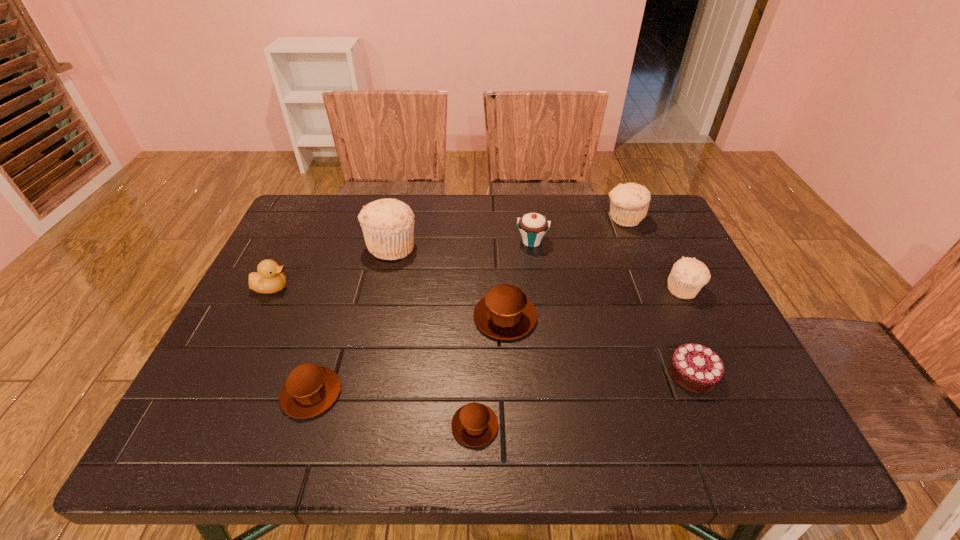
Locate an element on the screen. vacant region between the chocolate cake and the second biggest beige muffin is located at coordinates (659, 296).

In order to click on empty space that is in between the nearest beige muffin and the smallest brown muffin in this screenshot , I will do `click(580, 357)`.

Locate an element on the screen. object that is the sixth nearest to the leftmost object is located at coordinates (629, 203).

This screenshot has width=960, height=540. I want to click on object that stands as the fourth closest to the biggest brown muffin, so click(x=696, y=368).

Locate an element on the screen. This screenshot has height=540, width=960. muffin that is the sixth closest one to the leftmost object is located at coordinates (688, 275).

Choose which muffin is the fifth nearest neighbor to the nearest beige muffin. Please provide its 2D coordinates. Your answer should be formatted as a tuple, i.e. [(x, y)], where the tuple contains the x and y coordinates of a point satisfying the conditions above.

[(310, 389)]

I want to click on beige muffin object that ranks as the second closest to the second shortest muffin, so click(x=688, y=275).

Identify the location of beige muffin that is the third closest to the shortest muffin. Image resolution: width=960 pixels, height=540 pixels. (629, 203).

Identify the location of brown muffin that can be found as the second closest to the fifth tallest muffin. (505, 313).

Identify the location of the third closest brown muffin relative to the chocolate cake. The height and width of the screenshot is (540, 960). (310, 389).